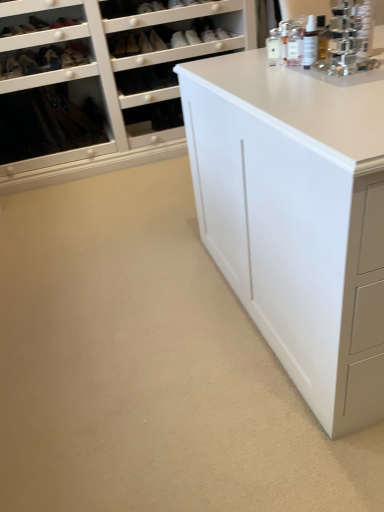
Question: From a real-world perspective, is matte black shoe at upper center, positioned as the third shoe in left-to-right order, below clear plastic spray bottle at upper right, which is the second toiletry in left-to-right order?

Choices:
 (A) yes
 (B) no

Answer: (B)

Question: Can you confirm if matte black shoe at upper center, positioned as the third shoe in left-to-right order, is wider than clear plastic spray bottle at upper right, which is the second toiletry in left-to-right order?

Choices:
 (A) no
 (B) yes

Answer: (B)

Question: Is matte black shoe at upper center, arranged as the 1th shoe when viewed from the right, next to clear plastic spray bottle at upper right, the second toiletry from the back, and touching it?

Choices:
 (A) yes
 (B) no

Answer: (B)

Question: From the image's perspective, is matte black shoe at upper center, arranged as the 1th shoe when viewed from the right, on top of clear plastic spray bottle at upper right, which is the second toiletry in left-to-right order?

Choices:
 (A) no
 (B) yes

Answer: (B)

Question: Is matte black shoe at upper center, positioned as the third shoe in left-to-right order, positioned beyond the bounds of clear plastic spray bottle at upper right, which is counted as the 1th toiletry, starting from the front?

Choices:
 (A) yes
 (B) no

Answer: (A)

Question: Is point (31, 71) closer or farther from the camera than point (276, 46)?

Choices:
 (A) farther
 (B) closer

Answer: (A)

Question: Would you say matte black shoe at upper left, the 1th shoe from the left, is to the left or to the right of white glass bottle at upper right, the second toiletry viewed from the front, in the picture?

Choices:
 (A) left
 (B) right

Answer: (A)

Question: From the image's perspective, is matte black shoe at upper left, the 3th shoe viewed from the right, positioned above or below white glass bottle at upper right, the second toiletry viewed from the front?

Choices:
 (A) above
 (B) below

Answer: (A)

Question: Considering the positions of matte black shoe at upper left, the 3th shoe viewed from the right, and white glass bottle at upper right, which is the second toiletry in right-to-left order, in the image, is matte black shoe at upper left, the 3th shoe viewed from the right, bigger or smaller than white glass bottle at upper right, which is the second toiletry in right-to-left order,?

Choices:
 (A) small
 (B) big

Answer: (B)

Question: Is matte black shoe at upper center, positioned as the third shoe in left-to-right order, inside or outside of clear plastic spray bottle at upper right, which is the second toiletry in left-to-right order?

Choices:
 (A) outside
 (B) inside

Answer: (A)

Question: From the image's perspective, is matte black shoe at upper center, arranged as the 1th shoe when viewed from the right, positioned above or below clear plastic spray bottle at upper right, which is counted as the 1th toiletry, starting from the front?

Choices:
 (A) below
 (B) above

Answer: (B)

Question: Is matte black shoe at upper center, arranged as the 1th shoe when viewed from the right, taller or shorter than clear plastic spray bottle at upper right, which is counted as the 1th toiletry, starting from the front?

Choices:
 (A) tall
 (B) short

Answer: (B)

Question: Is matte black shoe at upper center, arranged as the 1th shoe when viewed from the right, in front of or behind clear plastic spray bottle at upper right, which is the 1th toiletry in right-to-left order, in the image?

Choices:
 (A) front
 (B) behind

Answer: (B)

Question: Looking at the image, does matte black shoe at upper left, the 1th shoe from the left, seem bigger or smaller compared to clear plastic spray bottle at upper right, the second toiletry from the back?

Choices:
 (A) small
 (B) big

Answer: (B)

Question: Considering their positions, is matte black shoe at upper left, the 3th shoe viewed from the right, located in front of or behind clear plastic spray bottle at upper right, which is counted as the 1th toiletry, starting from the front?

Choices:
 (A) behind
 (B) front

Answer: (A)